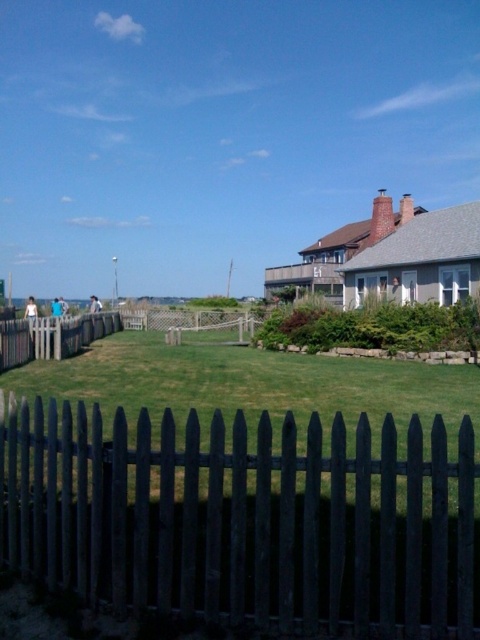
Question: Estimate the real-world distances between objects in this image. Which object is farther from the wooden picket fence at center?

Choices:
 (A) green grass at center
 (B) dark wood picket fence at center

Answer: (B)

Question: Considering the relative positions of green grass at center and wooden picket fence at center in the image provided, where is green grass at center located with respect to wooden picket fence at center?

Choices:
 (A) right
 (B) left

Answer: (A)

Question: Does dark wood picket fence at center appear on the left side of wooden picket fence at center?

Choices:
 (A) yes
 (B) no

Answer: (B)

Question: Can you confirm if dark wood picket fence at center is positioned to the right of wooden picket fence at center?

Choices:
 (A) yes
 (B) no

Answer: (A)

Question: Which is nearer to the dark wood picket fence at center?

Choices:
 (A) green grass at center
 (B) wooden picket fence at center

Answer: (A)

Question: Which point is farther to the camera?

Choices:
 (A) [50, 385]
 (B) [50, 330]
 (C) [468, 480]

Answer: (B)